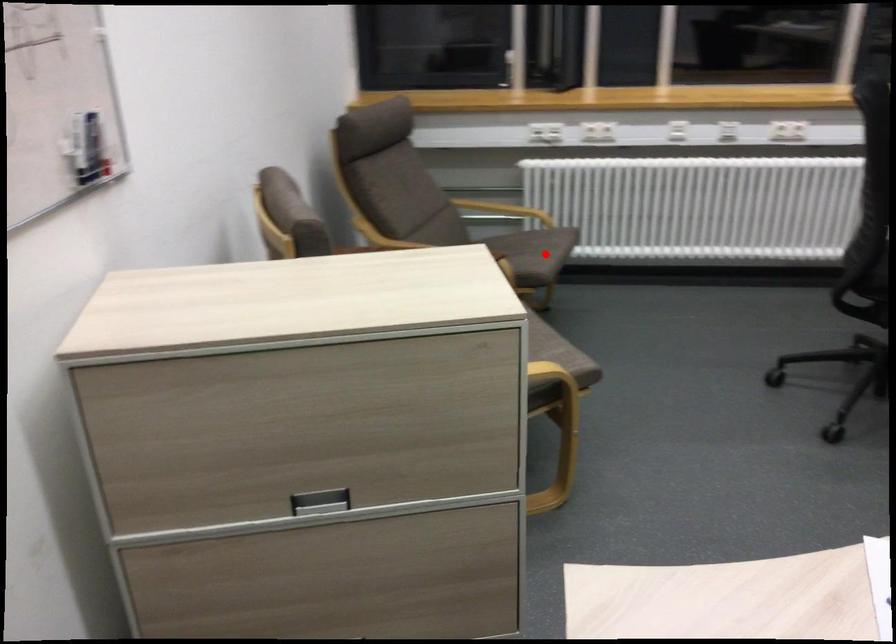
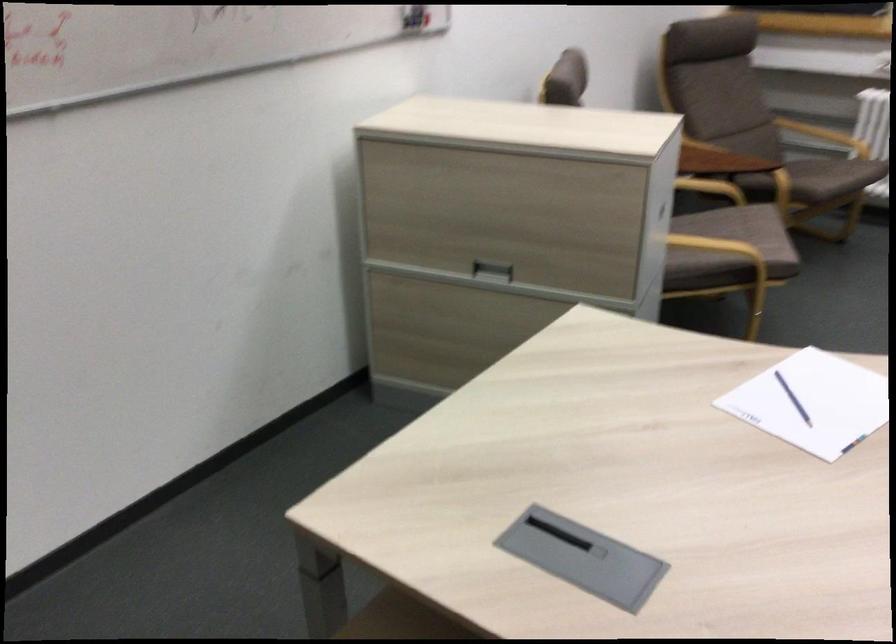
Find the pixel in the second image that matches the highlighted location in the first image.

(831, 176)